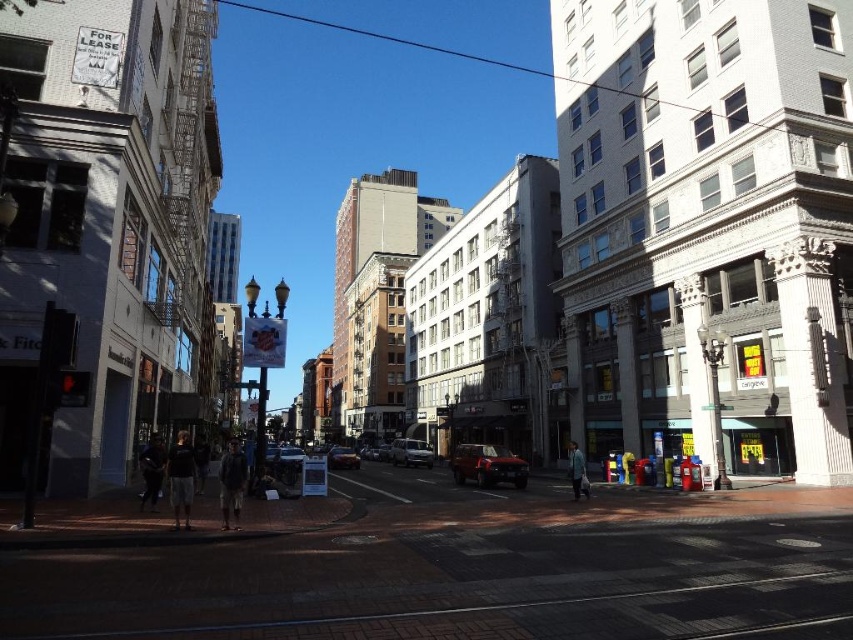
You are a delivery driver who needs to park your vehicle between the shiny dark red suv at center and the metallic silver car at center. The parking spot between them is 15 feet long. Can your 14.5 feet long delivery van fit in this space?

The parking spot between the shiny dark red suv at center and the metallic silver car at center is 15 feet long. Since your delivery van is 14.5 feet long, it can fit within the available space.

You are a delivery person trying to park your delivery van, which is 2 meters wide, between the silver metallic sedan at center and the metallic silver car at center. Based on the scene, can your van fit in the space between them?

The silver metallic sedan at center is thinner than the metallic silver car at center, but the exact width of the space between them isn t specified. Without knowing the distance between the two vehicles, it s impossible to determine if the van will fit. Please check the actual space before attempting to park.